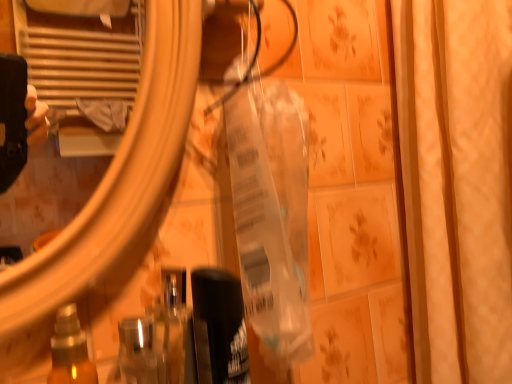
Question: Should I look upward or downward to see beige fabric shower curtain at right?

Choices:
 (A) down
 (B) up

Answer: (A)